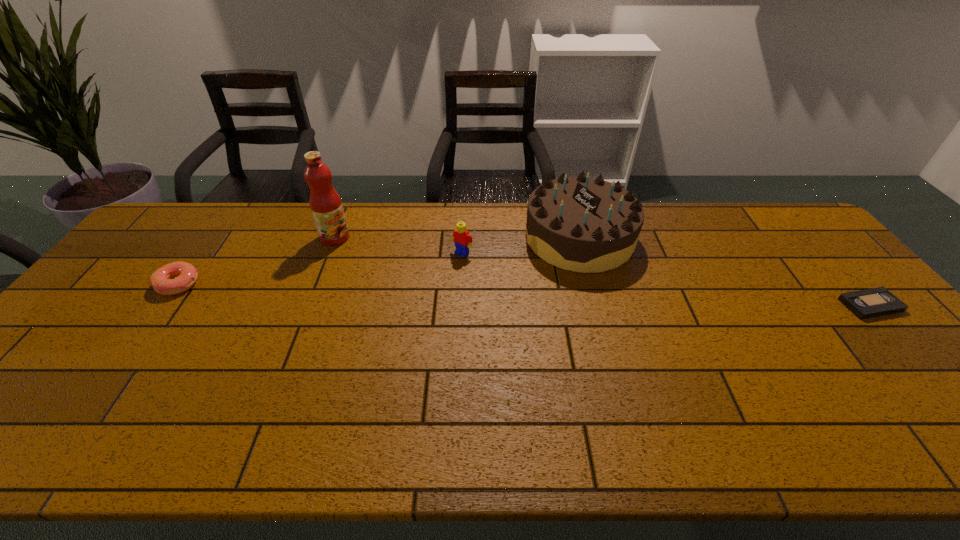
This screenshot has height=540, width=960. In order to click on blank area located on the front-facing side of the Lego in this screenshot , I will do `click(444, 270)`.

I want to click on fruit juice located in the far edge section of the desktop, so click(326, 206).

You are a GUI agent. You are given a task and a screenshot of the screen. Output one action in this format:
    pyautogui.click(x=<x>, y=<y>)
    Task: Click on the birthday cake located at the far edge
    The width and height of the screenshot is (960, 540).
    Given the screenshot: What is the action you would take?
    pyautogui.click(x=580, y=224)

Image resolution: width=960 pixels, height=540 pixels. Find the location of `object present at the left edge`. object present at the left edge is located at coordinates (185, 274).

Locate an element on the screen. The image size is (960, 540). object that is at the right edge is located at coordinates (868, 303).

What are the coordinates of `vacant area at the far edge` in the screenshot? It's located at (262, 226).

The height and width of the screenshot is (540, 960). In order to click on free point at the near edge in this screenshot , I will do (x=140, y=388).

Identify the location of vacant region at the left edge of the desktop. (122, 306).

Locate an element on the screen. The width and height of the screenshot is (960, 540). free space at the right edge of the desktop is located at coordinates (790, 268).

The image size is (960, 540). Identify the location of free location at the far right corner of the desktop. (783, 216).